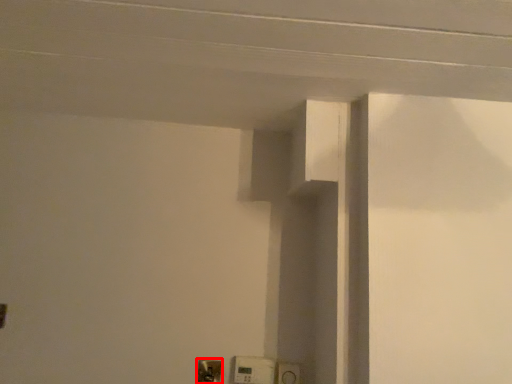
Question: From the image's perspective, where is light switch (annotated by the red box) located in relation to light switch in the image?

Choices:
 (A) below
 (B) above

Answer: (A)